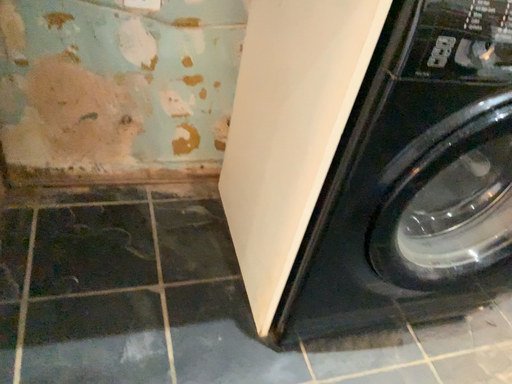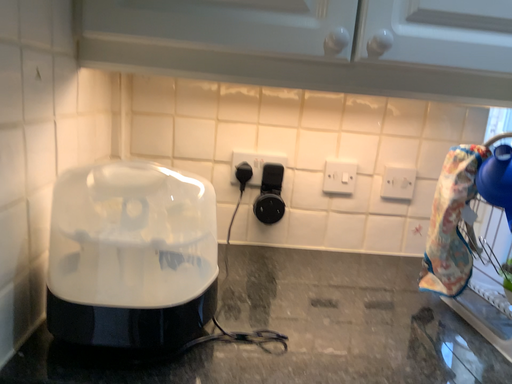
Question: How did the camera likely rotate when shooting the video?

Choices:
 (A) rotated right
 (B) rotated left

Answer: (B)